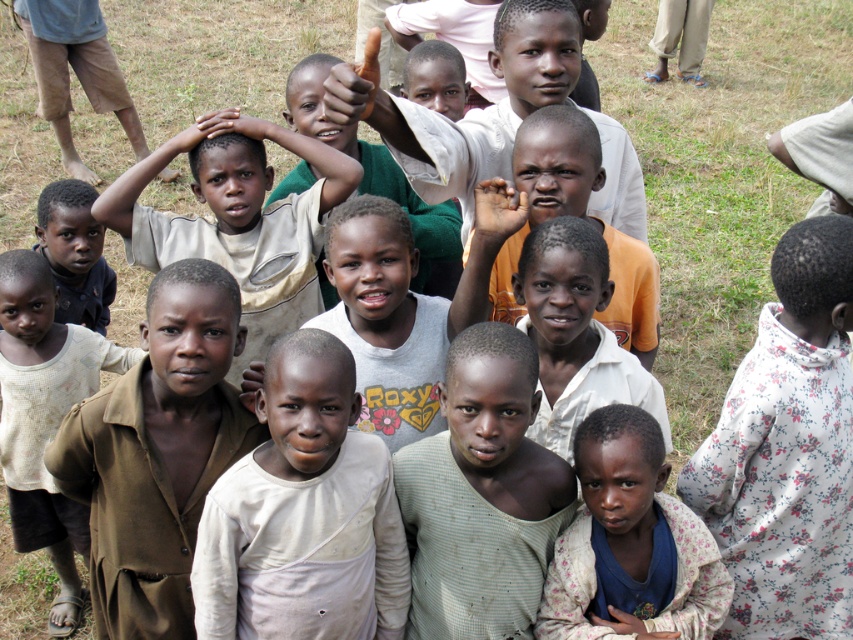
Question: Can you confirm if brown matte shirt at center is smaller than light green fabric shirt at center?

Choices:
 (A) yes
 (B) no

Answer: (B)

Question: Which object is farther from the camera taking this photo?

Choices:
 (A) white cotton shirt at center
 (B) light blue fabric shirt at lower right

Answer: (B)

Question: Estimate the real-world distances between objects in this image. Which object is farther from the white cotton shirt at center?

Choices:
 (A) brown cotton shirt at center
 (B) brown matte shirt at center
 (C) light blue fabric shirt at lower right
 (D) light brown fabric shirt at center

Answer: (D)

Question: Can you confirm if white cotton shirt at center is wider than brown cotton shirt at center?

Choices:
 (A) no
 (B) yes

Answer: (A)

Question: Can you confirm if white cotton shirt at center is wider than light blue fabric shirt at lower right?

Choices:
 (A) yes
 (B) no

Answer: (A)

Question: Which of the following is the farthest from the observer?

Choices:
 (A) (613, 604)
 (B) (485, 460)
 (C) (65, 353)
 (D) (198, 580)

Answer: (C)